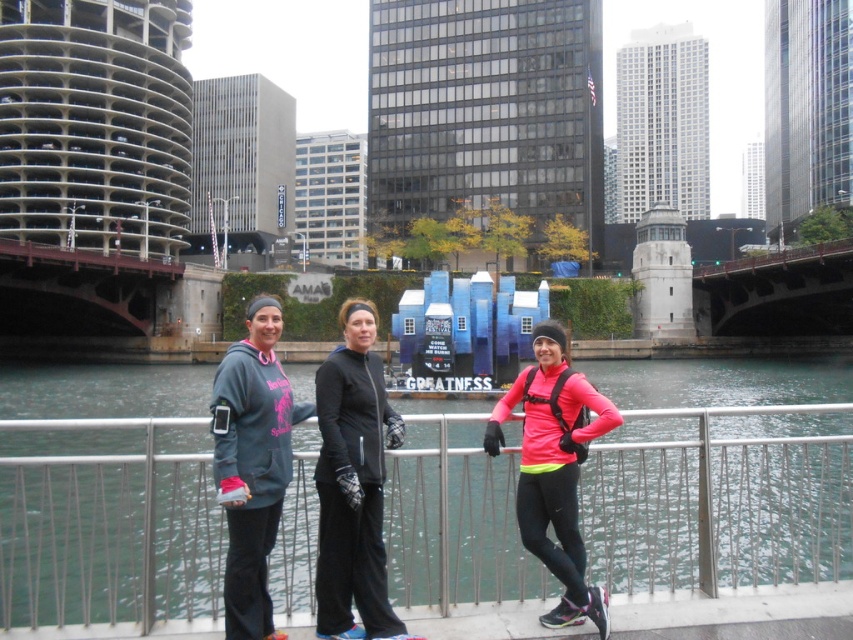
You are a city planner assessing the bridge structure. You need to know if the silver metallic railing at center is wider than the rusty metal bridge at left. Can you confirm this?

The silver metallic railing at center is wider than the rusty metal bridge at left according to the description.

You are a photographer trying to capture both the gray fleece sweatshirt at center and the pink matte jacket at center in a single shot. Which of the two should you focus on first to ensure both are in frame?

The gray fleece sweatshirt at center is much taller than the pink matte jacket at center, so you should focus on the gray fleece sweatshirt at center first to ensure both are in frame.

You are a city planner evaluating the structural integrity of the rusty metal bridge at left and the silver metallic railing at center. Based on their positions, which one is more likely to require immediate maintenance due to exposure to environmental factors?

The rusty metal bridge at left is more likely to require immediate maintenance because it is positioned above the silver metallic railing at center, making it more exposed to environmental factors like moisture and weathering.